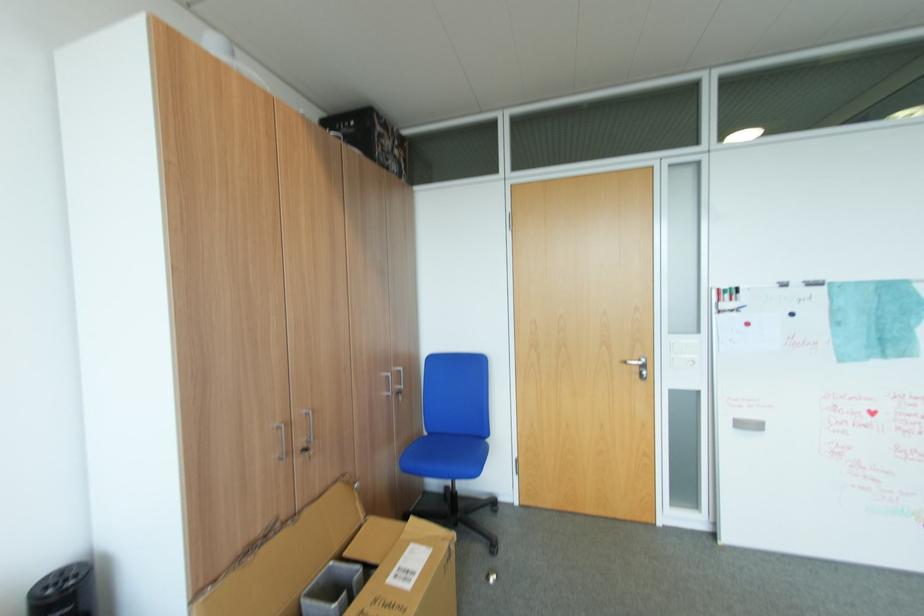
What are the coordinates of `cardboard box` in the screenshot? It's located at (339, 565).